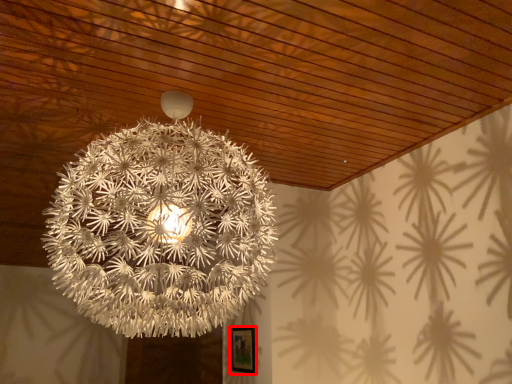
Question: Observing the image, what is the correct spatial positioning of picture frame (annotated by the red box) in reference to lamp?

Choices:
 (A) right
 (B) left

Answer: (A)